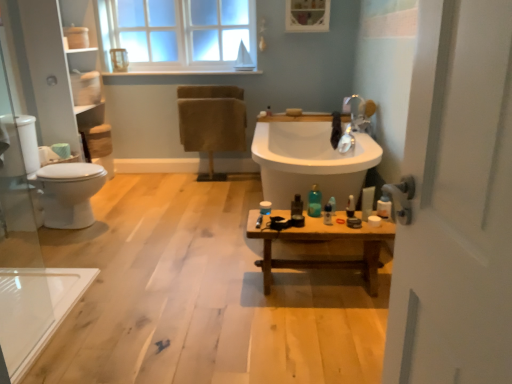
I want to click on free space in front of wooden bench at center, so pyautogui.click(x=313, y=328).